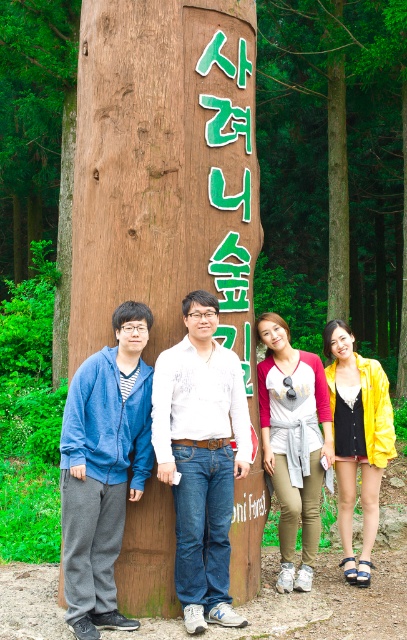
Question: Which object is the closest to the wooden signpost at center?

Choices:
 (A) white cotton shirt at center
 (B) yellow shiny jacket at lower right
 (C) red and white baseball jersey at center
 (D) denim jacket at left

Answer: (A)

Question: Among these objects, which one is farthest from the camera?

Choices:
 (A) denim jacket at left
 (B) white cotton shirt at center
 (C) wooden signpost at center

Answer: (C)

Question: Can you confirm if white cotton shirt at center is positioned above red and white baseball jersey at center?

Choices:
 (A) no
 (B) yes

Answer: (B)

Question: Considering the relative positions of wooden signpost at center and red and white baseball jersey at center in the image provided, where is wooden signpost at center located with respect to red and white baseball jersey at center?

Choices:
 (A) left
 (B) right

Answer: (A)

Question: Which point is closer to the camera taking this photo?

Choices:
 (A) (236, 440)
 (B) (253, 192)
 (C) (304, 570)

Answer: (A)

Question: Is wooden signpost at center to the left of yellow shiny jacket at lower right from the viewer's perspective?

Choices:
 (A) yes
 (B) no

Answer: (A)